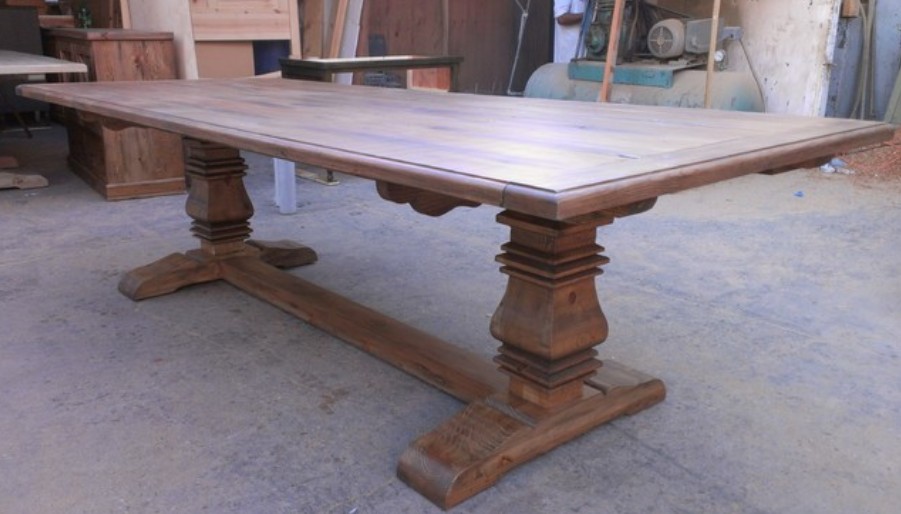
This screenshot has width=901, height=514. Find the location of `unfinished wood`. unfinished wood is located at coordinates (213, 22), (40, 65).